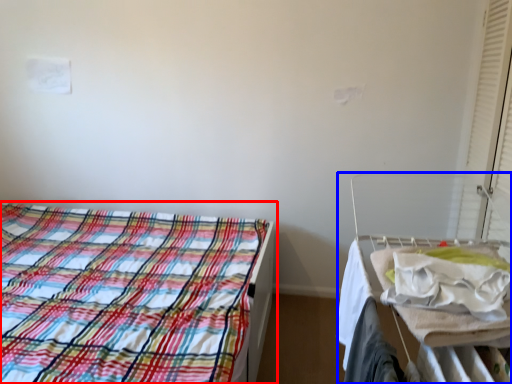
Question: Which point is further to the camera, bed (highlighted by a red box) or hospital bed (highlighted by a blue box)?

Choices:
 (A) bed
 (B) hospital bed

Answer: (A)